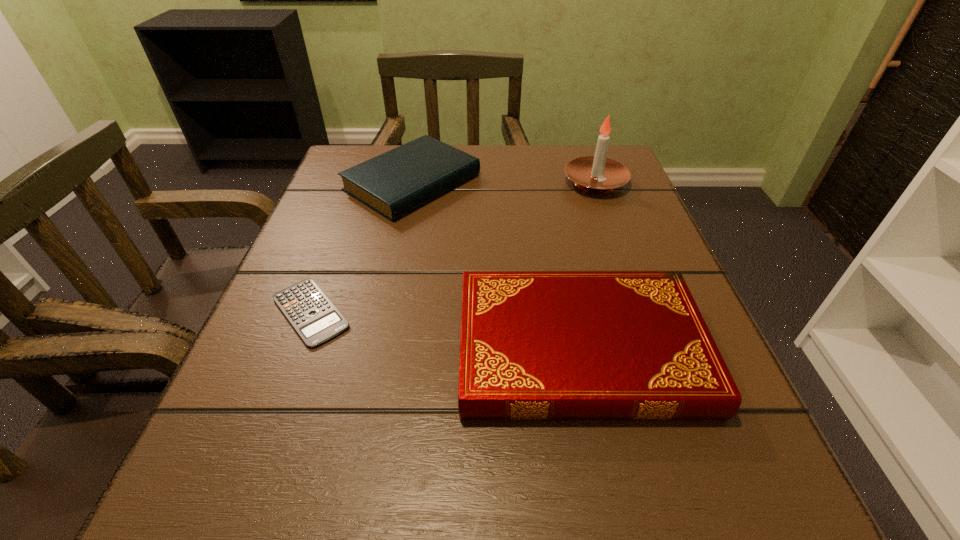
The image size is (960, 540). Find the location of `candle that is at the far edge`. candle that is at the far edge is located at coordinates (596, 174).

The image size is (960, 540). I want to click on book positioned at the far edge, so click(x=399, y=181).

Find the location of `book that is at the left edge`. book that is at the left edge is located at coordinates (399, 181).

Identify the location of calculator present at the left edge. (314, 317).

Identify the location of candle at the right edge. This screenshot has width=960, height=540. (596, 174).

At what (x,y) coordinates should I click in order to perform the action: click on hardback book that is at the right edge. Please return your answer as a coordinate pair (x, y). Looking at the image, I should click on (534, 345).

Find the location of a particular element. The height and width of the screenshot is (540, 960). object that is at the far left corner is located at coordinates pos(399,181).

At what (x,y) coordinates should I click in order to perform the action: click on object located in the far right corner section of the desktop. Please return your answer as a coordinate pair (x, y). Looking at the image, I should click on (596, 174).

Where is `vacant space at the far edge of the desktop`? Image resolution: width=960 pixels, height=540 pixels. vacant space at the far edge of the desktop is located at coordinates (518, 191).

In the image, there is a desktop. Where is `vacant space at the near edge`? The image size is (960, 540). vacant space at the near edge is located at coordinates (429, 491).